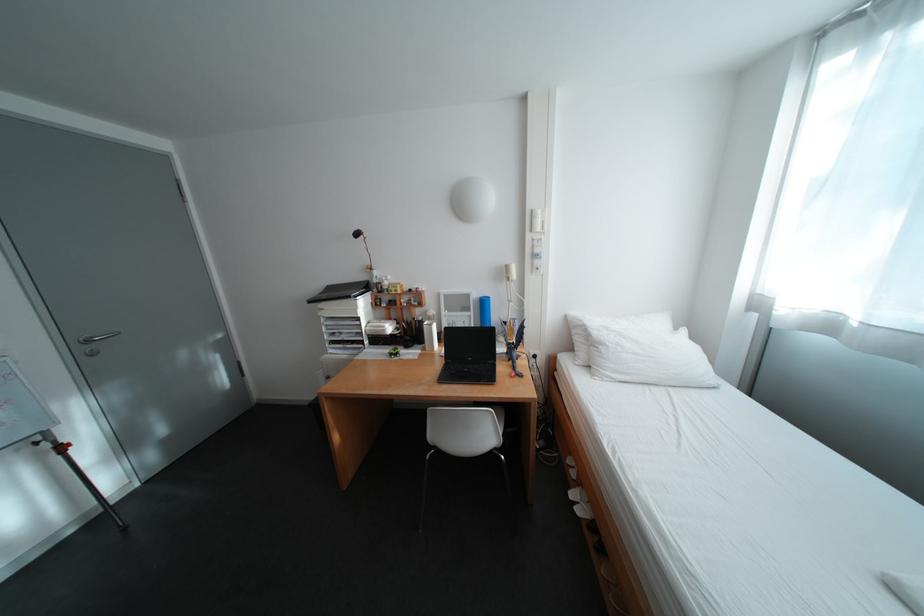
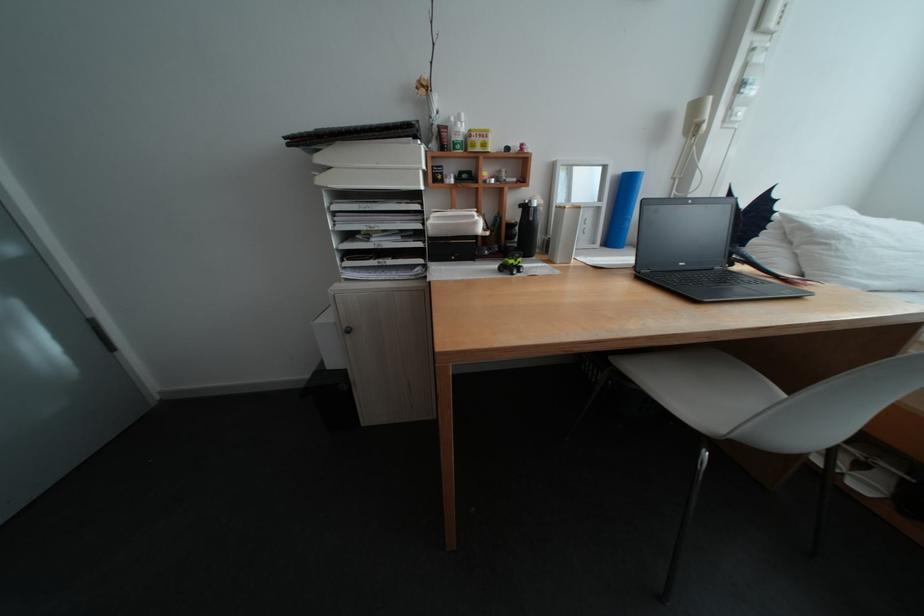
In a continuous first-person perspective shot, in which direction is the camera moving?

The cameraman walked toward left, forward.